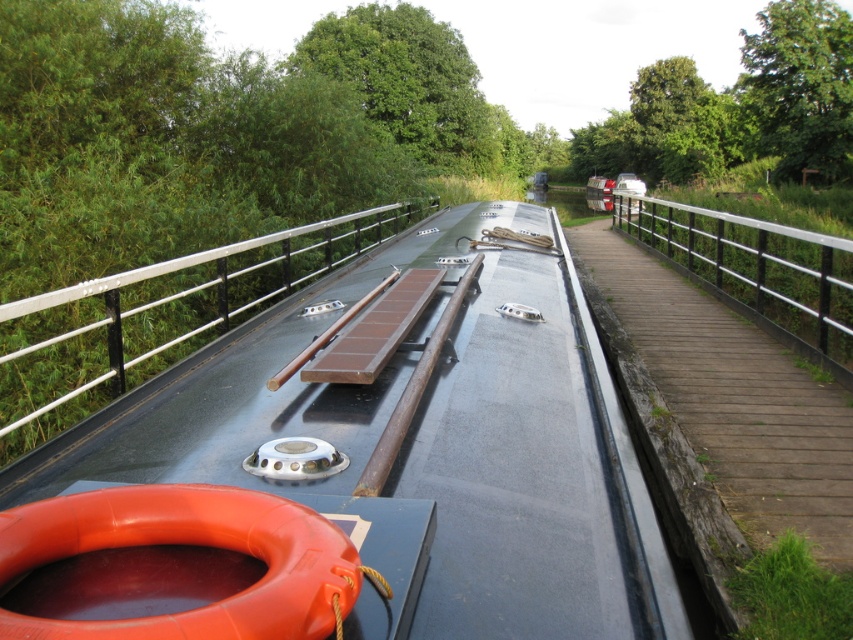
Question: Among these points, which one is farthest from the camera?

Choices:
 (A) (636, 227)
 (B) (177, 308)
 (C) (322, 488)

Answer: (A)

Question: Which object is closer to the camera taking this photo?

Choices:
 (A) silver metallic rail at center
 (B) silver metallic rail at right
 (C) metallic gray boat at center

Answer: (C)

Question: Observing the image, what is the correct spatial positioning of metallic gray boat at center in reference to silver metallic rail at center?

Choices:
 (A) left
 (B) right

Answer: (B)

Question: Can you confirm if metallic gray boat at center is positioned above silver metallic rail at center?

Choices:
 (A) yes
 (B) no

Answer: (A)

Question: Which point is farther to the camera?

Choices:
 (A) (103, 292)
 (B) (590, 490)

Answer: (A)

Question: Does metallic gray boat at center have a larger size compared to silver metallic rail at right?

Choices:
 (A) no
 (B) yes

Answer: (A)